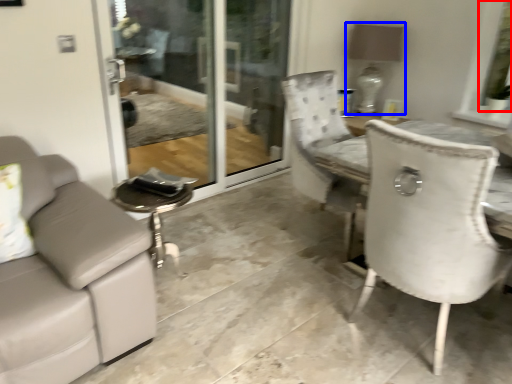
Question: Which point is further to the camera, window screen (highlighted by a red box) or lamp (highlighted by a blue box)?

Choices:
 (A) window screen
 (B) lamp

Answer: (B)